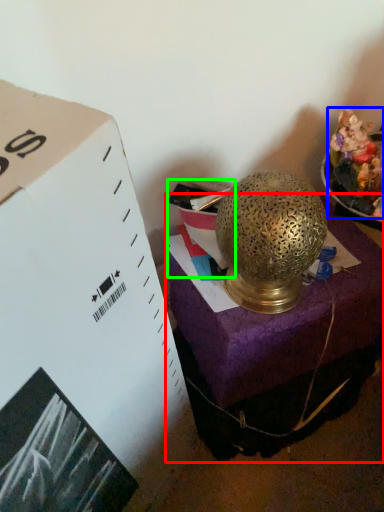
Question: Based on their relative distances, which object is nearer to furniture (highlighted by a red box)? Choose from food (highlighted by a blue box) and box (highlighted by a green box).

Choices:
 (A) food
 (B) box

Answer: (B)